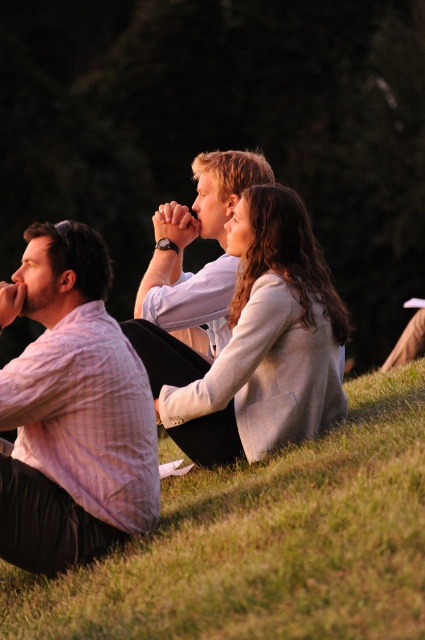
Does green grassy at lower left appear on the left side of light beige sweater at center?

Incorrect, green grassy at lower left is not on the left side of light beige sweater at center.

Between green grassy at lower left and light beige sweater at center, which one has more height?

Standing taller between the two is light beige sweater at center.

Image resolution: width=425 pixels, height=640 pixels. I want to click on green grassy at lower left, so click(x=265, y=544).

In the scene shown: Who is shorter, striped cotton shirt at left or matte white shirt at center?

Standing shorter between the two is matte white shirt at center.

Who is more distant from viewer, (99,314) or (152,285)?

Point (152,285)

Is point (62, 337) closer to camera compared to point (207, 205)?

Yes.

Image resolution: width=425 pixels, height=640 pixels. What are the coordinates of `striped cotton shirt at left` in the screenshot? It's located at (71, 410).

Is green grassy at lower left closer to the viewer compared to striped cotton shirt at left?

Yes, green grassy at lower left is in front of striped cotton shirt at left.

Is green grassy at lower left to the left of striped cotton shirt at left from the viewer's perspective?

In fact, green grassy at lower left is to the right of striped cotton shirt at left.

Who is more distant from viewer, (x=280, y=563) or (x=53, y=483)?

Positioned behind is point (x=53, y=483).

Identify the location of green grassy at lower left. (265, 544).